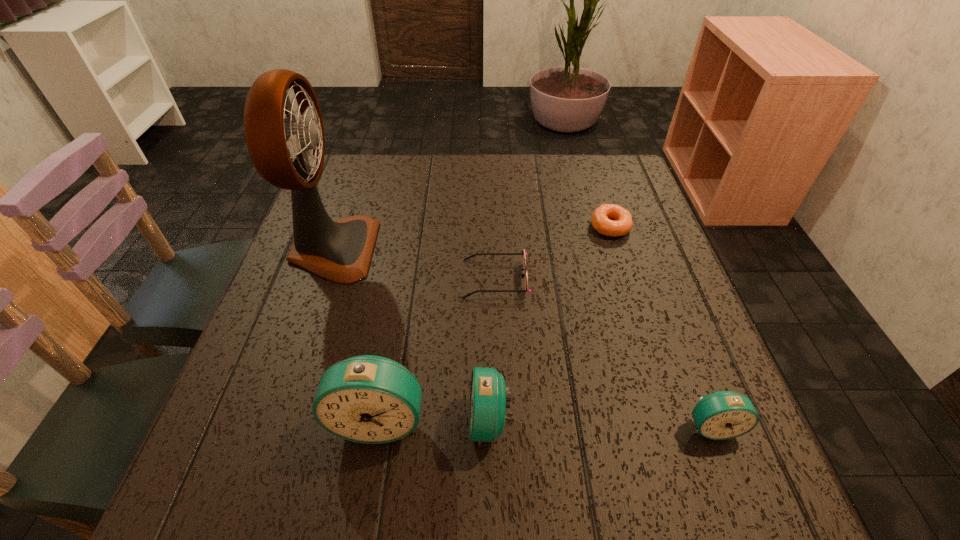
I want to click on unoccupied area between the fifth shortest object and the doughnut, so click(494, 323).

Image resolution: width=960 pixels, height=540 pixels. What are the coordinates of `vacant area that lies between the sunglasses and the leftmost alarm clock` in the screenshot? It's located at (438, 349).

At what (x,y) coordinates should I click in order to perform the action: click on vacant region between the second tallest alarm clock and the tallest object. Please return your answer as a coordinate pair (x, y). Image resolution: width=960 pixels, height=540 pixels. Looking at the image, I should click on (411, 335).

Find the location of a particular element. This screenshot has height=540, width=960. vacant space in between the shortest alarm clock and the fan is located at coordinates (522, 338).

This screenshot has height=540, width=960. I want to click on vacant space that is in between the leftmost alarm clock and the fan, so click(356, 334).

The image size is (960, 540). Find the location of `free space between the shortest alarm clock and the second tallest alarm clock`. free space between the shortest alarm clock and the second tallest alarm clock is located at coordinates (601, 423).

Find the location of a particular element. free point between the leftmost alarm clock and the sunglasses is located at coordinates (438, 349).

Where is `free space that is in between the fan and the shortest alarm clock`? This screenshot has height=540, width=960. free space that is in between the fan and the shortest alarm clock is located at coordinates (522, 338).

The image size is (960, 540). Find the location of `free space between the fan and the doughnut`. free space between the fan and the doughnut is located at coordinates (471, 238).

You are a GUI agent. You are given a task and a screenshot of the screen. Output one action in this format:
    pyautogui.click(x=<x>, y=<y>)
    Task: Click on the fourth closest object to the fourth shortest object
    Image resolution: width=960 pixels, height=540 pixels.
    Given the screenshot: What is the action you would take?
    pyautogui.click(x=289, y=154)